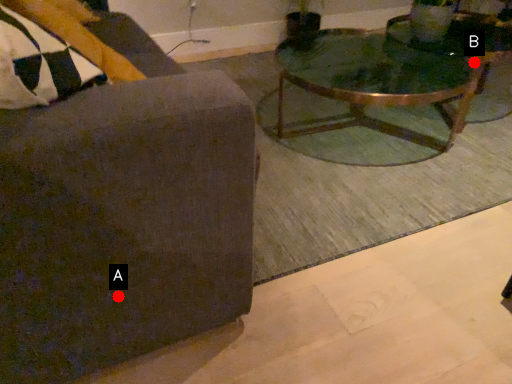
Question: Two points are circled on the image, labeled by A and B beside each circle. Among these points, which one is nearest to the camera?

Choices:
 (A) A is closer
 (B) B is closer

Answer: (A)